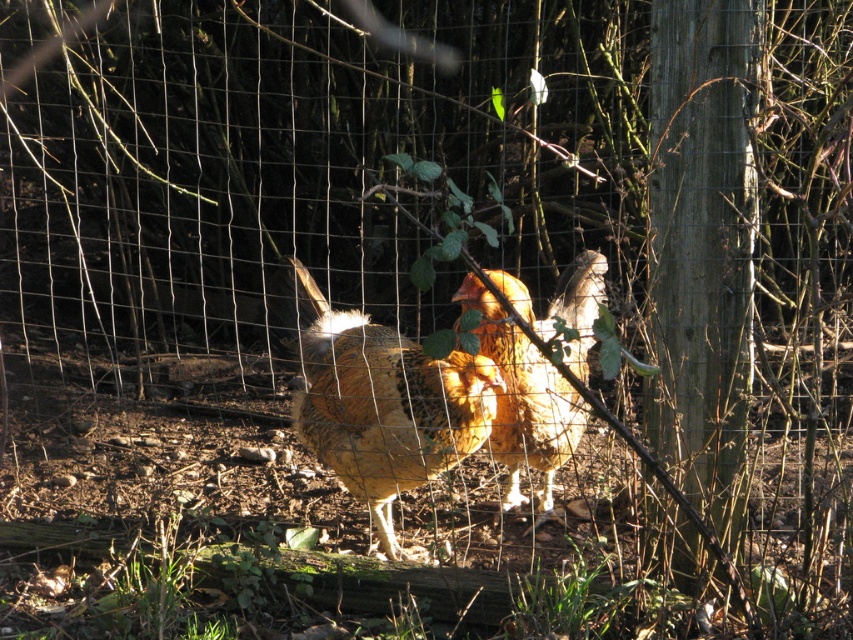
Can you confirm if golden speckled chicken at center is taller than golden feathered chicken at center?

Indeed, golden speckled chicken at center has a greater height compared to golden feathered chicken at center.

Who is positioned more to the right, golden speckled chicken at center or golden feathered chicken at center?

golden feathered chicken at center is more to the right.

This screenshot has height=640, width=853. What are the coordinates of `golden speckled chicken at center` in the screenshot? It's located at (386, 404).

This screenshot has width=853, height=640. I want to click on golden speckled chicken at center, so click(x=386, y=404).